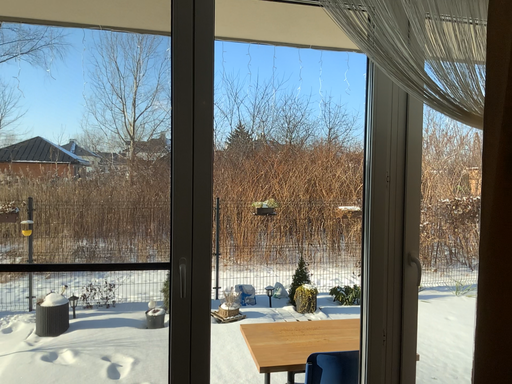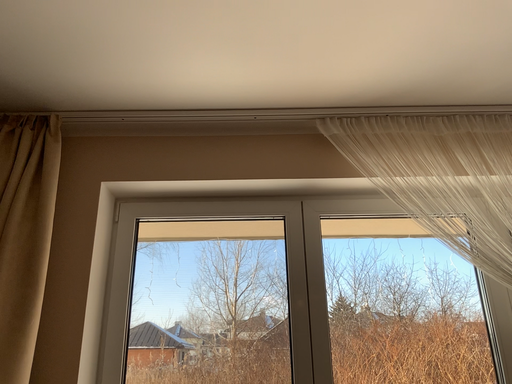
Question: Which way did the camera rotate in the video?

Choices:
 (A) rotated downward
 (B) rotated upward

Answer: (B)